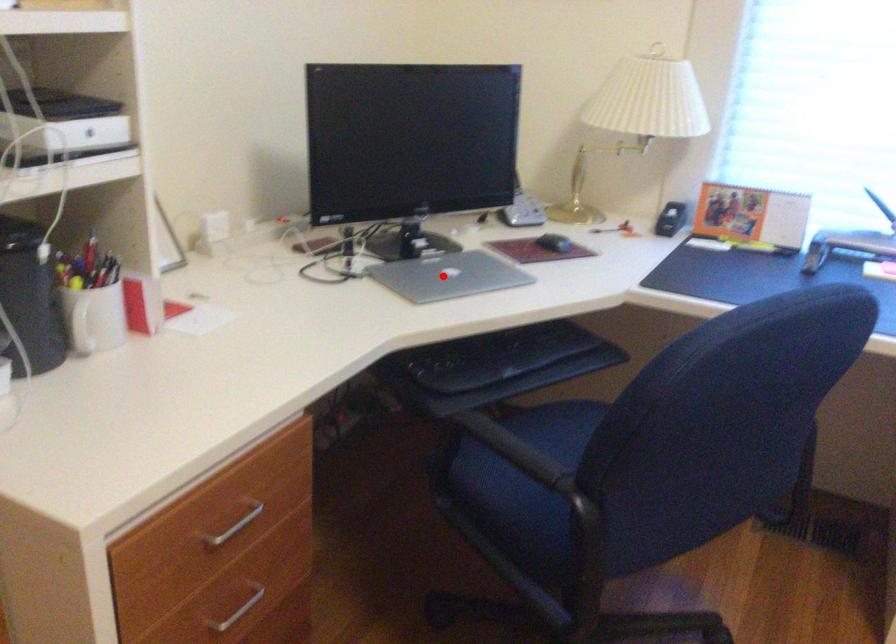
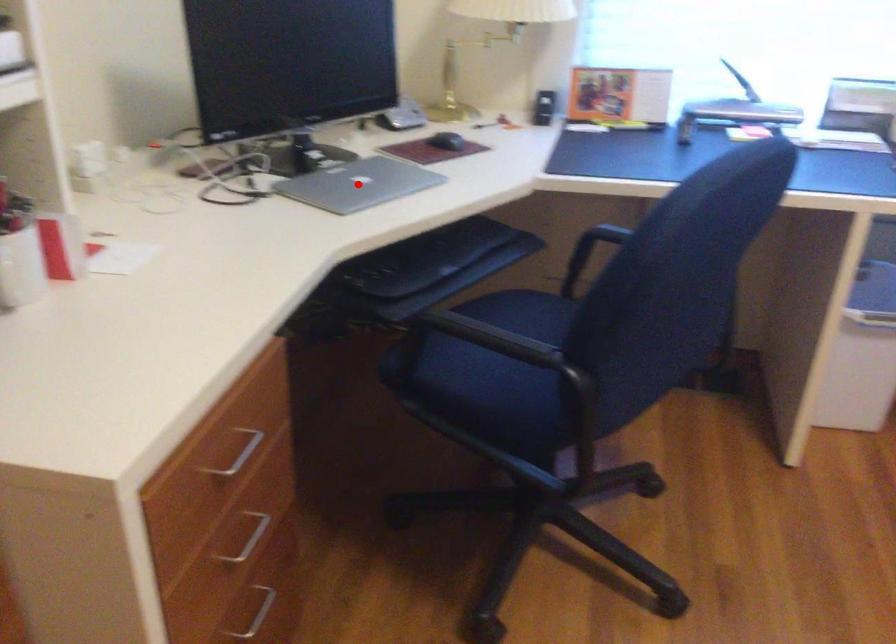
I am providing you with two images of the same scene from different viewpoints. A red point is marked on the first image and another point is marked on the second image. Do the highlighted points in image1 and image2 indicate the same real-world spot?

Yes